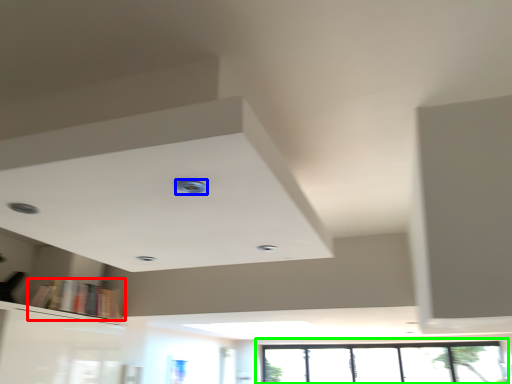
Question: Estimate the real-world distances between objects in this image. Which object is farther from book (highlighted by a red box), hole (highlighted by a blue box) or window (highlighted by a green box)?

Choices:
 (A) hole
 (B) window

Answer: (A)